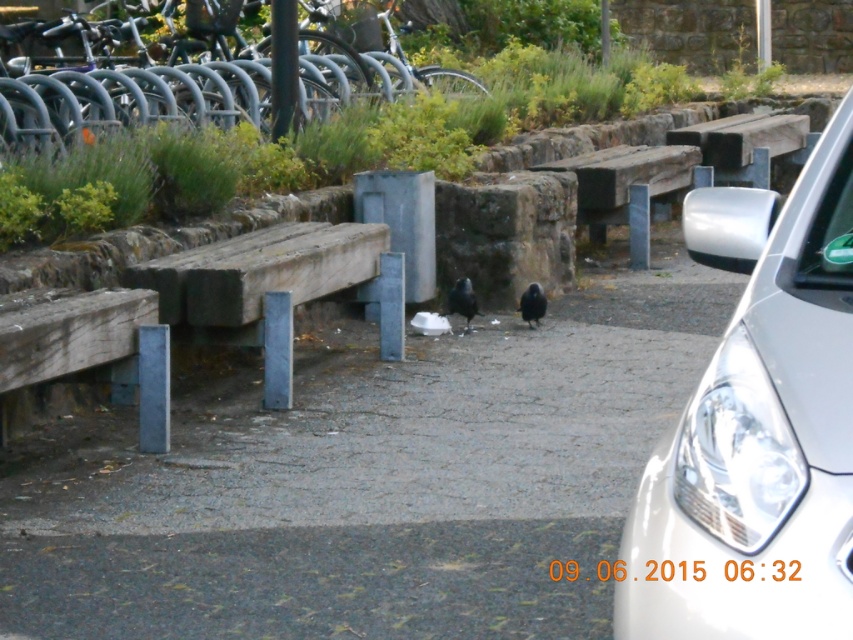
You are standing at the camera position and want to pick up an object located at point (633, 234) and another object at point (540, 317). Which point is closer to you?

Point (633, 234) is closer to you because it is further to the camera than point (540, 317).

You are a delivery person who needs to park your 4.2 meter long white glossy car at right as close as possible to the wooden bench at center without overlapping it. Is this possible?

The white glossy car at right is 3.97 meters away from the wooden bench at center. Since the car is 4.2 meters long, it cannot be parked without overlapping the wooden bench at center because the distance between them is shorter than the car length.